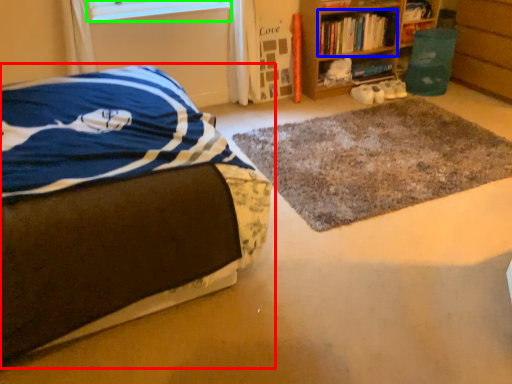
Question: Considering the real-world distances, which object is farthest from bed (highlighted by a red box)? book (highlighted by a blue box) or window screen (highlighted by a green box)?

Choices:
 (A) book
 (B) window screen

Answer: (A)